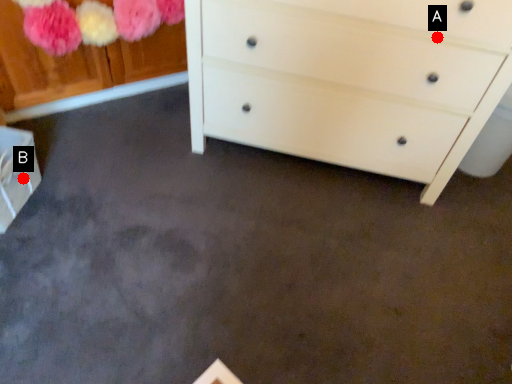
Question: Two points are circled on the image, labeled by A and B beside each circle. Which of the following is the farthest from the observer?

Choices:
 (A) A is further
 (B) B is further

Answer: (B)